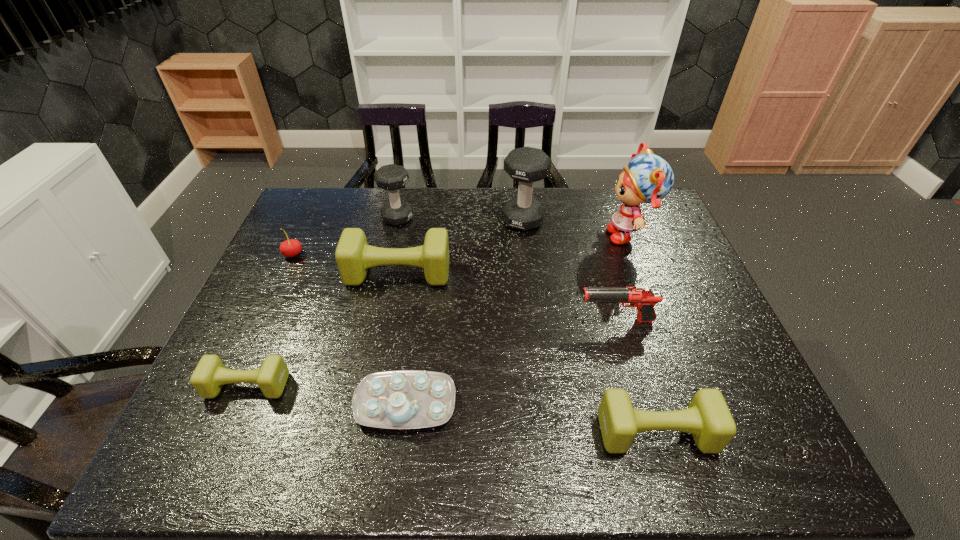
What are the coordinates of `doll` in the screenshot? It's located at (648, 178).

The width and height of the screenshot is (960, 540). In order to click on the bigger gray dumbbell in this screenshot , I will do `click(527, 165)`.

At what (x,y) coordinates should I click in order to perform the action: click on the tallest dumbbell. Please return your answer as a coordinate pair (x, y). The height and width of the screenshot is (540, 960). Looking at the image, I should click on (527, 165).

You are a GUI agent. You are given a task and a screenshot of the screen. Output one action in this format:
    pyautogui.click(x=<x>, y=<y>)
    Task: Click on the seventh shortest object
    Image resolution: width=960 pixels, height=540 pixels.
    Given the screenshot: What is the action you would take?
    coord(391,177)

Identify the location of the smaller gray dumbbell. coord(391,177).

Locate an element on the screen. the third nearest dumbbell is located at coordinates (353, 255).

You are a GUI agent. You are given a task and a screenshot of the screen. Output one action in this format:
    pyautogui.click(x=<x>, y=<y>)
    Task: Click on the second olive dumbbell from right to left
    This screenshot has width=960, height=540.
    Given the screenshot: What is the action you would take?
    pyautogui.click(x=353, y=255)

Locate an element on the screen. The image size is (960, 540). black gun is located at coordinates (642, 297).

Locate an element on the screen. This screenshot has width=960, height=540. the sixth farthest object is located at coordinates (642, 297).

The width and height of the screenshot is (960, 540). Identify the location of red cherry. (290, 248).